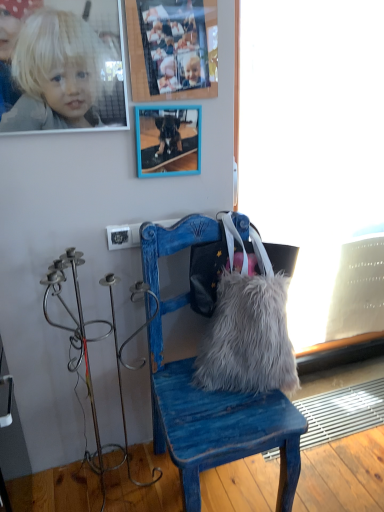
Question: From the image's perspective, is blue wooden picture frame at upper center, the 2th picture frame viewed from the top, located above frosted glass window screen at right?

Choices:
 (A) no
 (B) yes

Answer: (B)

Question: Can you confirm if blue wooden picture frame at upper center, the first picture frame when ordered from bottom to top, is thinner than frosted glass window screen at right?

Choices:
 (A) yes
 (B) no

Answer: (A)

Question: From the image's perspective, would you say blue wooden picture frame at upper center, the 2th picture frame viewed from the top, is shown under frosted glass window screen at right?

Choices:
 (A) yes
 (B) no

Answer: (B)

Question: From a real-world perspective, is blue wooden picture frame at upper center, the first picture frame when ordered from bottom to top, located higher than frosted glass window screen at right?

Choices:
 (A) no
 (B) yes

Answer: (B)

Question: Considering the relative sizes of blue wooden picture frame at upper center, the first picture frame when ordered from bottom to top, and frosted glass window screen at right in the image provided, is blue wooden picture frame at upper center, the first picture frame when ordered from bottom to top, wider than frosted glass window screen at right?

Choices:
 (A) no
 (B) yes

Answer: (A)

Question: Considering the relative sizes of blue wooden picture frame at upper center, the 2th picture frame viewed from the top, and frosted glass window screen at right in the image provided, is blue wooden picture frame at upper center, the 2th picture frame viewed from the top, bigger than frosted glass window screen at right?

Choices:
 (A) no
 (B) yes

Answer: (A)

Question: Considering the relative sizes of fuzzy fabric handbag at center and blue wooden chair at center in the image provided, is fuzzy fabric handbag at center shorter than blue wooden chair at center?

Choices:
 (A) no
 (B) yes

Answer: (B)

Question: Is fuzzy fabric handbag at center facing towards blue wooden chair at center?

Choices:
 (A) yes
 (B) no

Answer: (A)

Question: Is there a large distance between fuzzy fabric handbag at center and blue wooden chair at center?

Choices:
 (A) no
 (B) yes

Answer: (A)

Question: Is the depth of fuzzy fabric handbag at center greater than that of blue wooden chair at center?

Choices:
 (A) yes
 (B) no

Answer: (A)

Question: From a real-world perspective, is fuzzy fabric handbag at center beneath blue wooden chair at center?

Choices:
 (A) no
 (B) yes

Answer: (A)

Question: Can you confirm if fuzzy fabric handbag at center is wider than blue wooden chair at center?

Choices:
 (A) no
 (B) yes

Answer: (A)

Question: Does blonde hair at upper left have a larger size compared to frosted glass window screen at right?

Choices:
 (A) no
 (B) yes

Answer: (A)